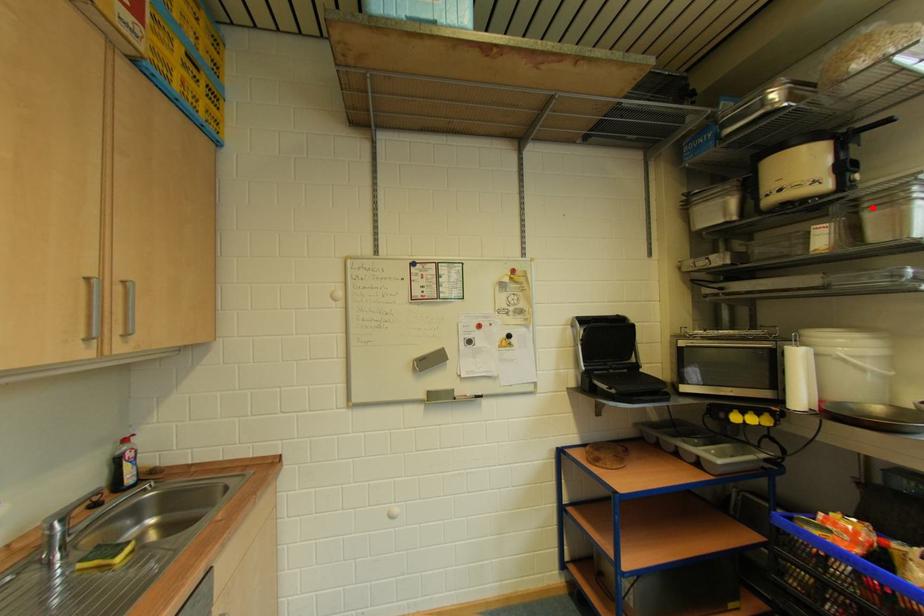
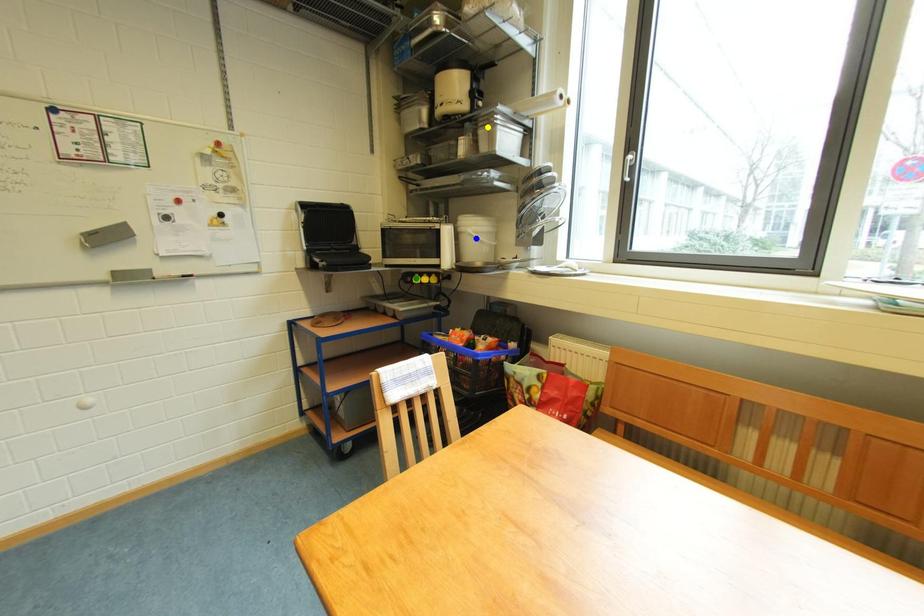
Question: I am providing you with two images of the same scene from different viewpoints. A red point is marked on the first image. You are given multiple points on the second image. Which point in image 2 represents the same 3d spot as the red point in image 1?

Choices:
 (A) blue point
 (B) yellow point
 (C) green point

Answer: (B)